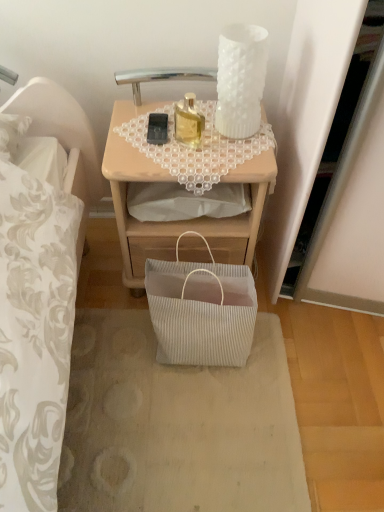
Identify the location of vacant space that is to the left of black matte mobile phone at upper center. (125, 126).